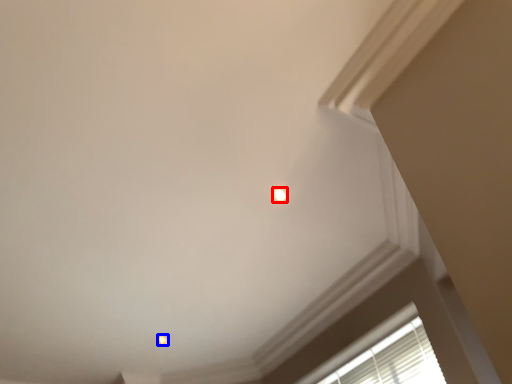
Question: Which object is further to the camera taking this photo, dot (highlighted by a red box) or dot (highlighted by a blue box)?

Choices:
 (A) dot
 (B) dot

Answer: (B)